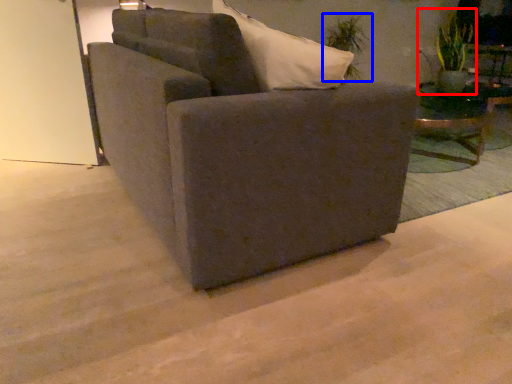
Question: Which object appears farthest to the camera in this image, plant (highlighted by a red box) or plant (highlighted by a blue box)?

Choices:
 (A) plant
 (B) plant

Answer: (B)